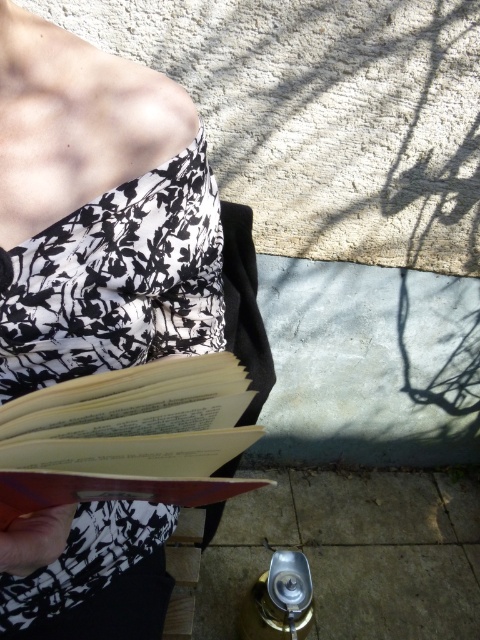
Question: Does black floral fabric dress at center have a greater width compared to light brown paper book at center?

Choices:
 (A) no
 (B) yes

Answer: (B)

Question: Which of the following is the farthest from the observer?

Choices:
 (A) black floral fabric dress at center
 (B) light brown paper book at center

Answer: (A)

Question: Considering the relative positions of black floral fabric dress at center and light brown paper book at center in the image provided, where is black floral fabric dress at center located with respect to light brown paper book at center?

Choices:
 (A) above
 (B) below

Answer: (A)

Question: Does black floral fabric dress at center have a lesser width compared to light brown paper book at center?

Choices:
 (A) no
 (B) yes

Answer: (A)

Question: Among these points, which one is nearest to the camera?

Choices:
 (A) [64, 257]
 (B) [158, 413]

Answer: (B)